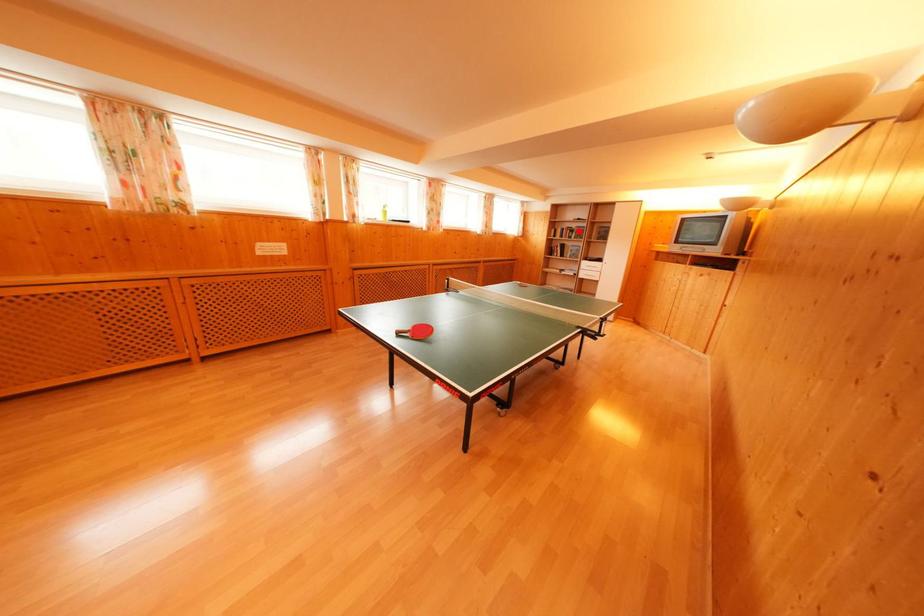
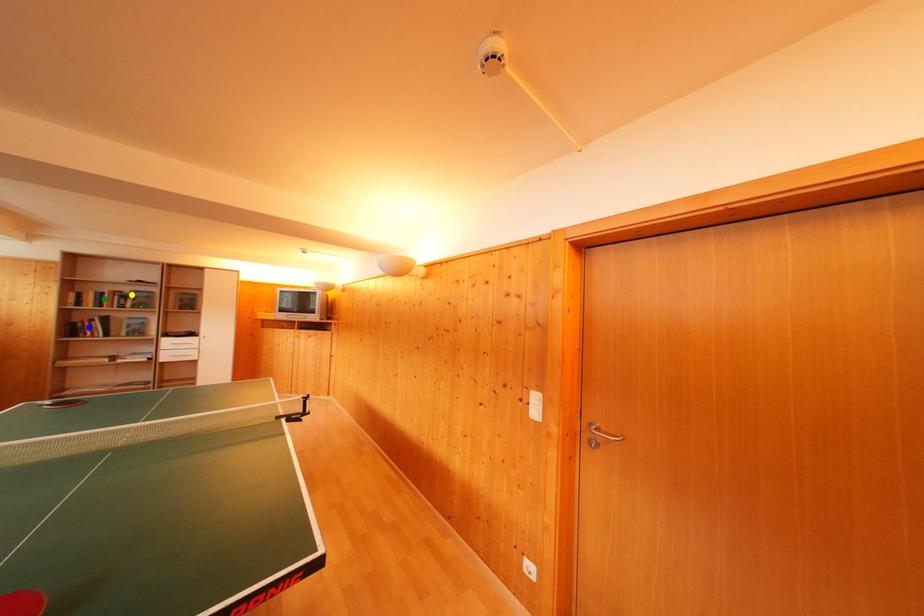
Question: I am providing you with two images of the same scene from different viewpoints. A red point is marked on the first image. You are given multiple points on the second image. Can you choose the point in image 2 that corresponds to the point in image 1?

Choices:
 (A) blue point
 (B) green point
 (C) yellow point

Answer: (C)